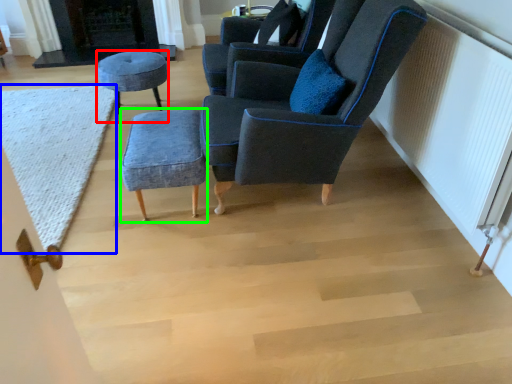
Question: Which object is positioned closest to stool (highlighted by a red box)? Select from mat (highlighted by a blue box) and stool (highlighted by a green box).

Choices:
 (A) mat
 (B) stool

Answer: (A)